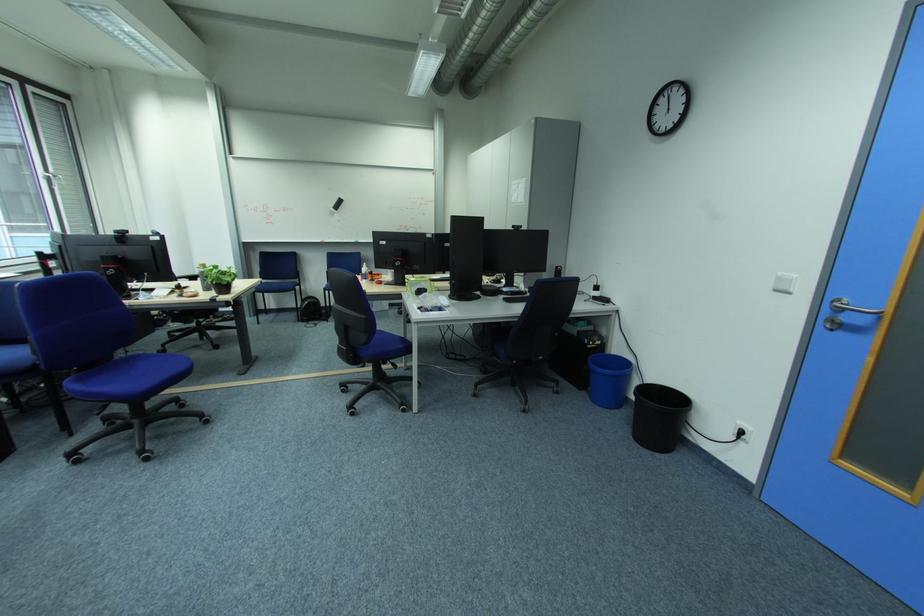
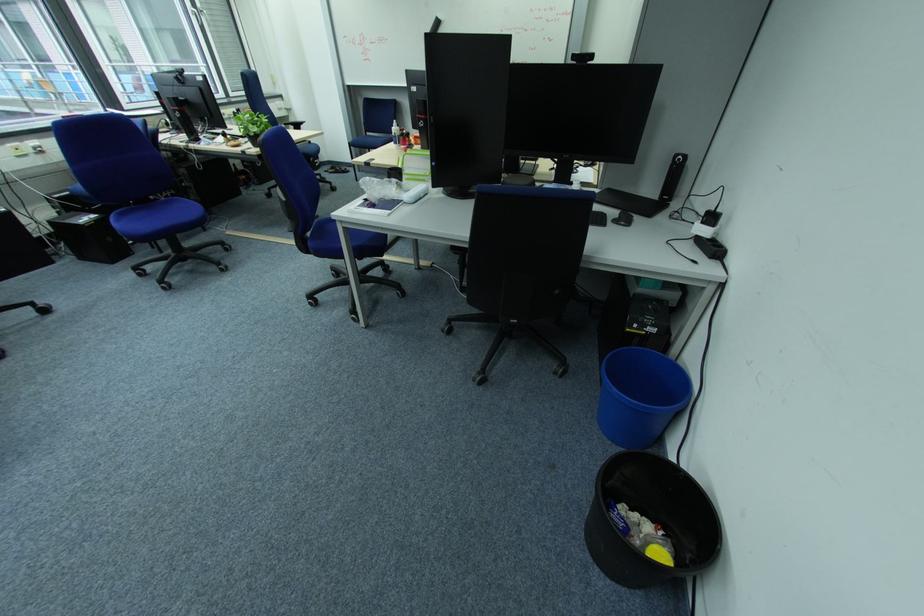
Where in the second image is the point corresponding to (640,439) from the first image?

(596, 514)